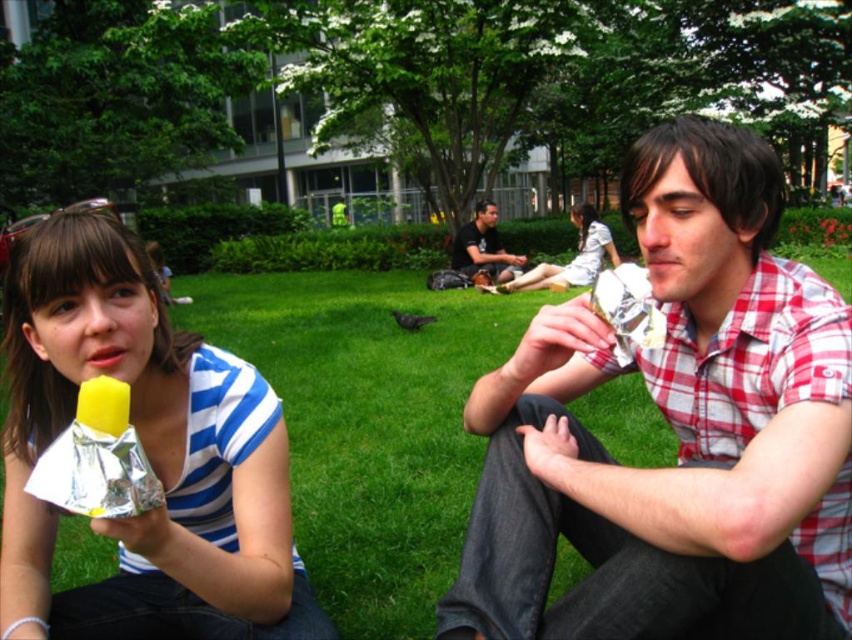
Based on the photo, you are planning to pack the white paper wrapped ice cream at center and the matte black shirt at center into a narrow box. Which object should you place first to ensure they both fit?

The white paper wrapped ice cream at center is thinner than the matte black shirt at center, so you should place the matte black shirt at center first to allow the thinner ice cream to fit around it.

From the picture: You are a photographer trying to capture both the white paper wrapped ice cream at center and the matte black shirt at center in the same frame. Based on their heights, which one will appear taller in the photo?

The matte black shirt at center appears taller in the photo because it is taller than the white paper wrapped ice cream at center.